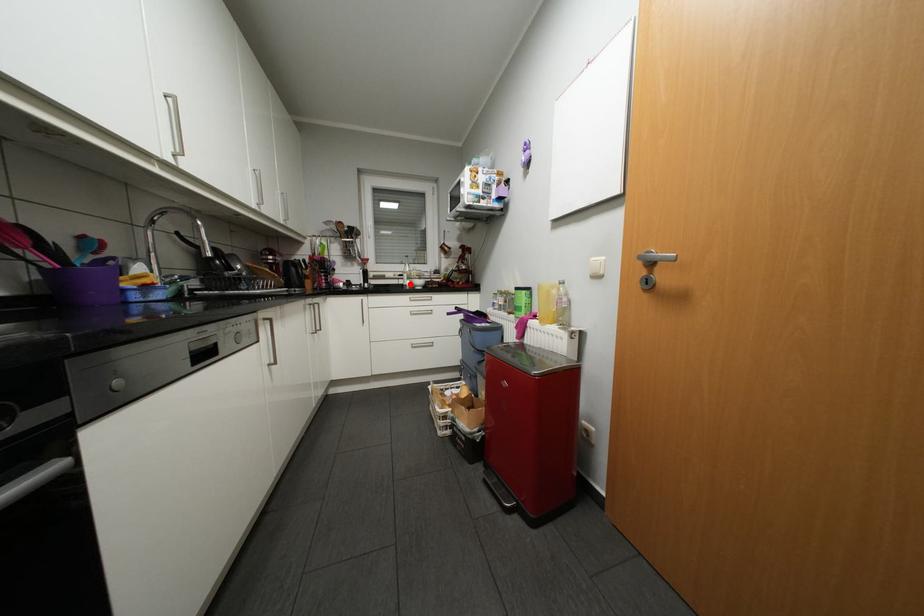
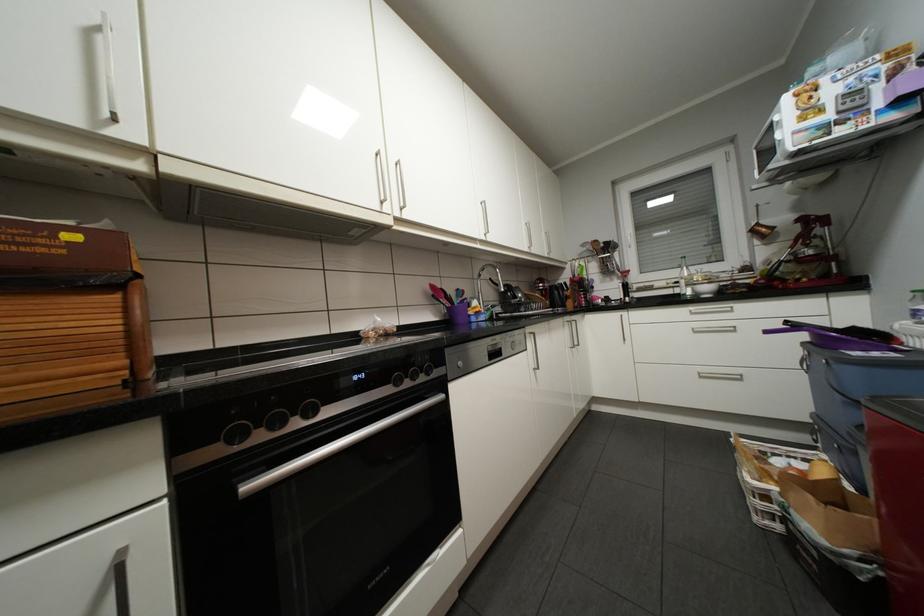
Where in the second image is the point corresponding to the highlighted location from the first image?

(687, 294)